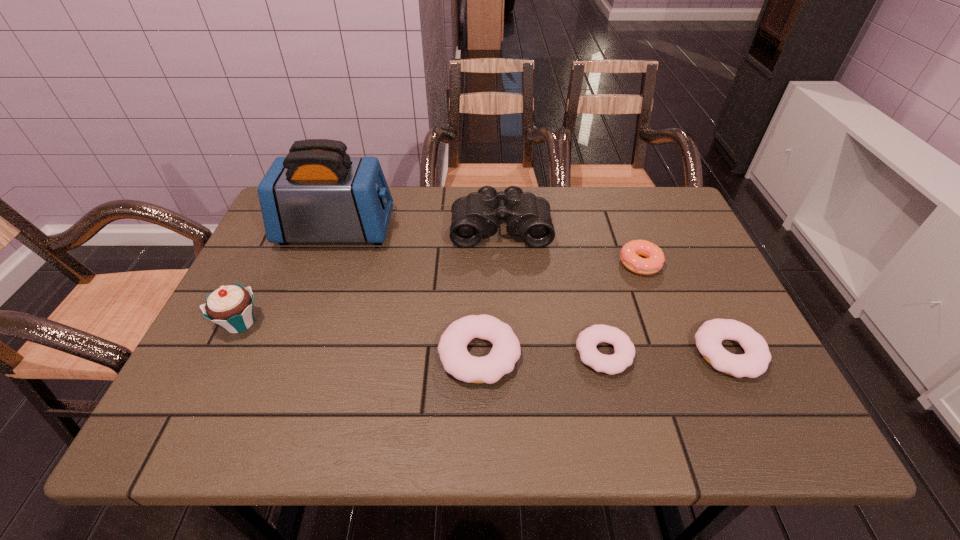
I want to click on the leftmost doughnut, so click(457, 361).

Where is `the fifth object from left to right`? the fifth object from left to right is located at coordinates (588, 339).

Where is `the second doughnut from left to right`? the second doughnut from left to right is located at coordinates (588, 339).

The image size is (960, 540). I want to click on the third tallest doughnut, so click(754, 362).

Identify the location of the tallest object. This screenshot has width=960, height=540. (317, 193).

Find the location of a particular element. Image resolution: width=960 pixels, height=540 pixels. the farthest doughnut is located at coordinates (654, 258).

I want to click on binoculars, so click(475, 216).

Image resolution: width=960 pixels, height=540 pixels. What are the coordinates of `cupcake` in the screenshot? It's located at (231, 307).

What are the coordinates of `vacant space positioned 0.140m on the left of the leftmost doughnut` in the screenshot? It's located at click(x=373, y=354).

You are a GUI agent. You are given a task and a screenshot of the screen. Output one action in this format:
    pyautogui.click(x=<x>, y=<y>)
    Task: Click on the vacant space located on the right of the fifth object from left to right
    Image resolution: width=960 pixels, height=540 pixels.
    Given the screenshot: What is the action you would take?
    pyautogui.click(x=721, y=353)